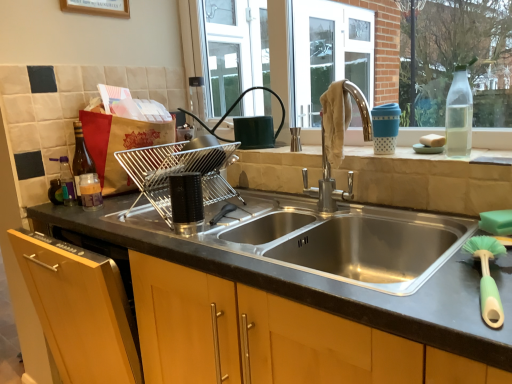
Question: Does transparent glass bottle at upper right, which is the 1th bottle from front to back, have a lesser width compared to green plastic brush at lower right?

Choices:
 (A) yes
 (B) no

Answer: (A)

Question: Does transparent glass bottle at upper right, which is the 1th bottle from front to back, have a larger size compared to green plastic brush at lower right?

Choices:
 (A) yes
 (B) no

Answer: (B)

Question: Considering the relative positions of transparent glass bottle at upper right, the first bottle positioned from the right, and green plastic brush at lower right in the image provided, is transparent glass bottle at upper right, the first bottle positioned from the right, to the right of green plastic brush at lower right from the viewer's perspective?

Choices:
 (A) no
 (B) yes

Answer: (B)

Question: Is transparent glass bottle at upper right, which is the 4th bottle in back-to-front order, outside of green plastic brush at lower right?

Choices:
 (A) no
 (B) yes

Answer: (B)

Question: Does transparent glass bottle at upper right, positioned as the fourth bottle in left-to-right order, have a smaller size compared to green plastic brush at lower right?

Choices:
 (A) yes
 (B) no

Answer: (A)

Question: Is transparent glass bottle at upper right, which is the 4th bottle in back-to-front order, taller or shorter than black plastic dish rack at center, marked as the second appliance in a back-to-front arrangement?

Choices:
 (A) short
 (B) tall

Answer: (B)

Question: In terms of size, does transparent glass bottle at upper right, which is the 1th bottle from front to back, appear bigger or smaller than black plastic dish rack at center, marked as the second appliance in a back-to-front arrangement?

Choices:
 (A) small
 (B) big

Answer: (A)

Question: From the image's perspective, is transparent glass bottle at upper right, which is the 4th bottle in back-to-front order, located above or below black plastic dish rack at center, arranged as the first appliance when viewed from the front?

Choices:
 (A) above
 (B) below

Answer: (A)

Question: Based on their positions, is transparent glass bottle at upper right, positioned as the fourth bottle in left-to-right order, located to the left or right of black plastic dish rack at center, marked as the second appliance in a back-to-front arrangement?

Choices:
 (A) left
 (B) right

Answer: (B)

Question: Is point (159, 167) positioned closer to the camera than point (52, 185)?

Choices:
 (A) closer
 (B) farther

Answer: (B)

Question: Choose the correct answer: Is stainless steel sink at center inside translucent plastic bottle at left, the 1th bottle positioned from the left, or outside it?

Choices:
 (A) inside
 (B) outside

Answer: (B)

Question: From a real-world perspective, relative to translucent plastic bottle at left, the first bottle positioned from the back, is stainless steel sink at center vertically above or below?

Choices:
 (A) above
 (B) below

Answer: (A)

Question: Considering the positions of stainless steel sink at center and translucent plastic bottle at left, placed as the fourth bottle when sorted from front to back, in the image, is stainless steel sink at center taller or shorter than translucent plastic bottle at left, placed as the fourth bottle when sorted from front to back,?

Choices:
 (A) short
 (B) tall

Answer: (B)

Question: From the image's perspective, is matte glass bottle at left, the 3th bottle positioned from the front, positioned above or below stainless steel sink at center?

Choices:
 (A) above
 (B) below

Answer: (A)

Question: Is matte glass bottle at left, placed as the second bottle when sorted from back to front, inside or outside of stainless steel sink at center?

Choices:
 (A) inside
 (B) outside

Answer: (B)